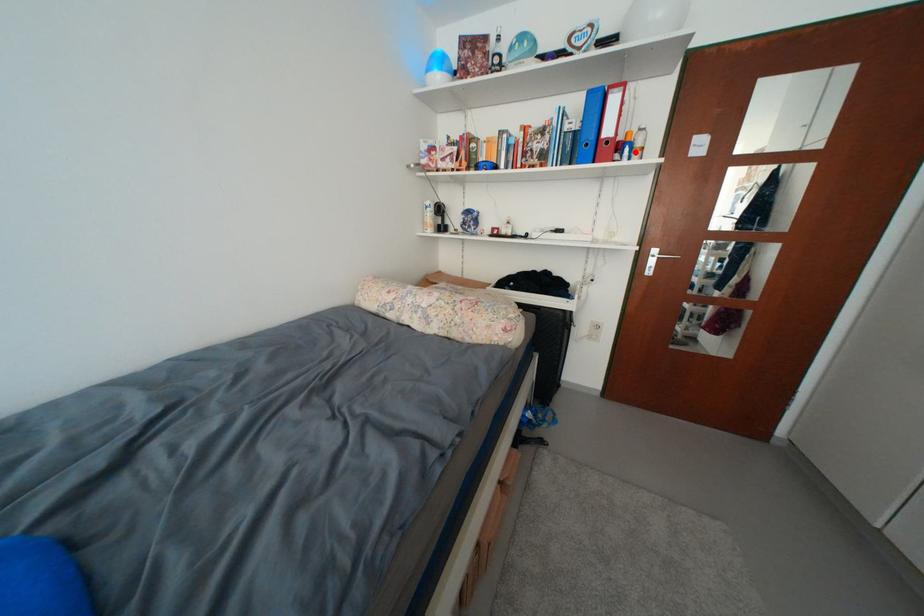
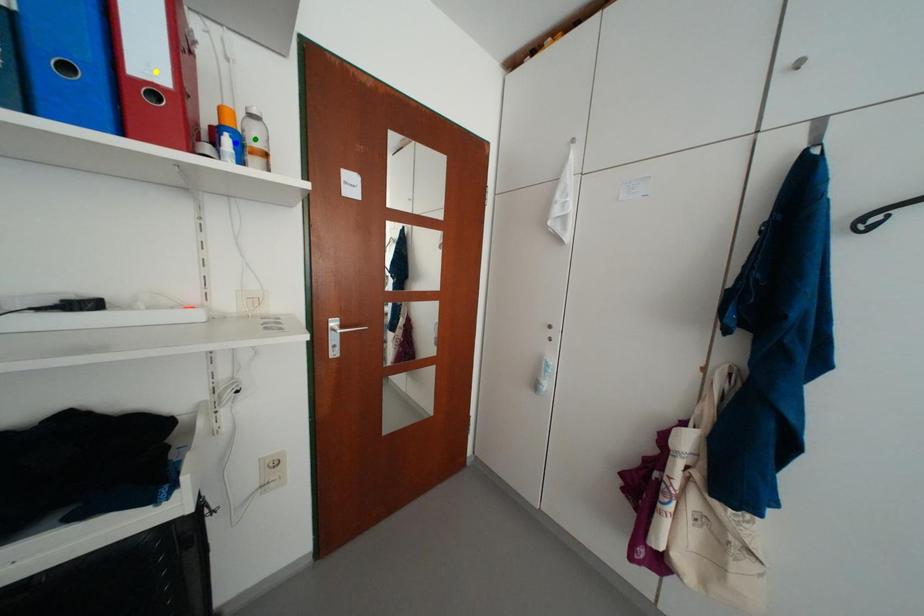
Question: I am providing you with two images of the same scene from different viewpoints. A red point is marked on the first image. You are given multiple points on the second image. Which point in image 2 is actually the same real-world point as the red point in image 1?

Choices:
 (A) green point
 (B) blue point
 (C) yellow point

Answer: (B)